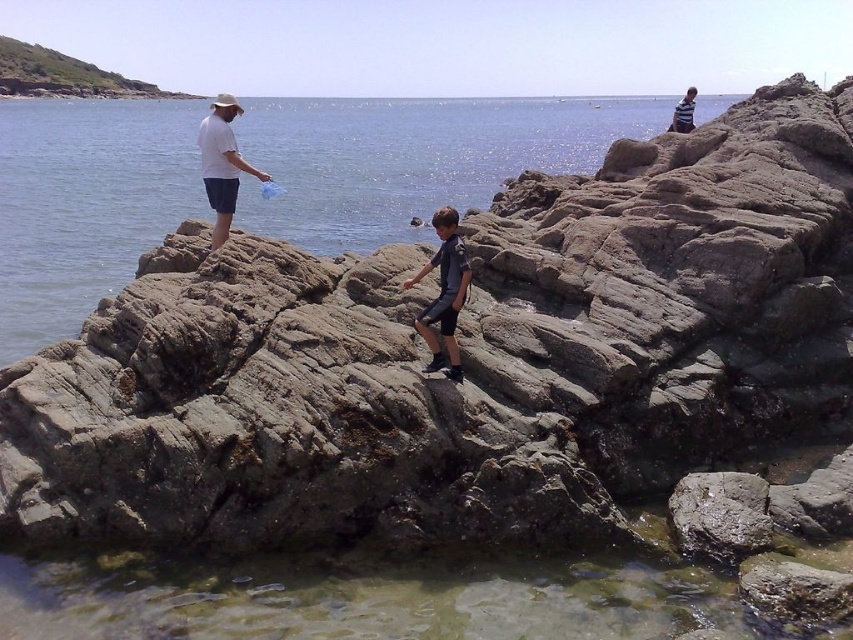
Does clear water at rocks center have a lesser height compared to light brown wooden chair at upper right?

Indeed, clear water at rocks center has a lesser height compared to light brown wooden chair at upper right.

Is clear water at rocks center above light brown wooden chair at upper right?

Incorrect, clear water at rocks center is not positioned above light brown wooden chair at upper right.

I want to click on clear water at rocks center, so click(413, 157).

Does gray rough rock at lower right appear on the right side of dark blue fabric shorts at center?

Indeed, gray rough rock at lower right is positioned on the right side of dark blue fabric shorts at center.

Does gray rough rock at lower right appear over dark blue fabric shorts at center?

No.

Is point (704, 488) farther from camera compared to point (450, 212)?

That is False.

Locate an element on the screen. This screenshot has width=853, height=640. gray rough rock at lower right is located at coordinates (720, 515).

Can you confirm if gray rough rock at lower right is wider than green grassy hillside at upper left?

Incorrect, gray rough rock at lower right's width does not surpass green grassy hillside at upper left's.

Who is more forward, (680, 544) or (112, 83)?

Point (680, 544) is more forward.

Between point (753, 483) and point (61, 64), which one is positioned behind?

Point (61, 64)

Where is `gray rough rock at lower right`? The width and height of the screenshot is (853, 640). gray rough rock at lower right is located at coordinates (720, 515).